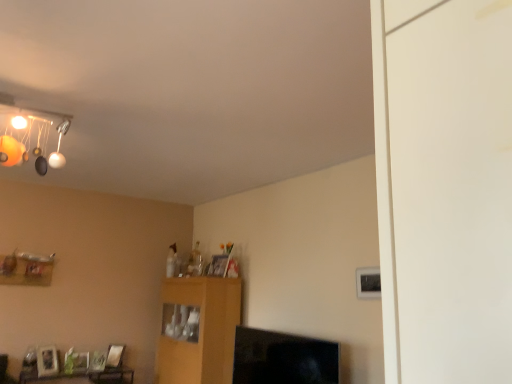
Question: From the image's perspective, is wooden table at lower left below wooden cabinet at center?

Choices:
 (A) yes
 (B) no

Answer: (A)

Question: Is wooden cabinet at center at the back of wooden table at lower left?

Choices:
 (A) no
 (B) yes

Answer: (A)

Question: Considering the relative sizes of wooden table at lower left and wooden cabinet at center in the image provided, is wooden table at lower left smaller than wooden cabinet at center?

Choices:
 (A) no
 (B) yes

Answer: (B)

Question: Considering the relative sizes of wooden table at lower left and wooden cabinet at center in the image provided, is wooden table at lower left bigger than wooden cabinet at center?

Choices:
 (A) no
 (B) yes

Answer: (A)

Question: Considering the relative positions of wooden table at lower left and wooden cabinet at center in the image provided, is wooden table at lower left to the right of wooden cabinet at center from the viewer's perspective?

Choices:
 (A) yes
 (B) no

Answer: (B)

Question: Does wooden table at lower left have a lesser height compared to wooden cabinet at center?

Choices:
 (A) yes
 (B) no

Answer: (A)

Question: Considering the relative positions of wooden cabinet at center and wooden shelf at lower left in the image provided, is wooden cabinet at center behind wooden shelf at lower left?

Choices:
 (A) no
 (B) yes

Answer: (A)

Question: Is the depth of wooden cabinet at center less than that of wooden shelf at lower left?

Choices:
 (A) yes
 (B) no

Answer: (A)

Question: From a real-world perspective, is wooden cabinet at center under wooden shelf at lower left?

Choices:
 (A) no
 (B) yes

Answer: (B)

Question: Can you confirm if wooden cabinet at center is smaller than wooden shelf at lower left?

Choices:
 (A) no
 (B) yes

Answer: (A)

Question: Considering the relative positions of wooden cabinet at center and wooden shelf at lower left in the image provided, is wooden cabinet at center to the left of wooden shelf at lower left from the viewer's perspective?

Choices:
 (A) no
 (B) yes

Answer: (A)

Question: Does wooden cabinet at center appear on the right side of wooden shelf at lower left?

Choices:
 (A) yes
 (B) no

Answer: (A)

Question: Is wooden cabinet at center not within wooden table at lower left?

Choices:
 (A) yes
 (B) no

Answer: (A)